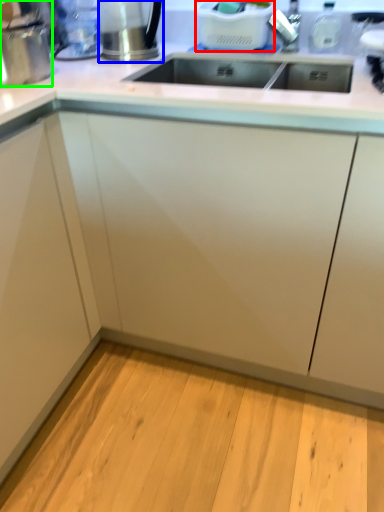
Question: Which object is positioned farthest from appliance (highlighted by a red box)? Select from appliance (highlighted by a blue box) and appliance (highlighted by a green box).

Choices:
 (A) appliance
 (B) appliance

Answer: (B)